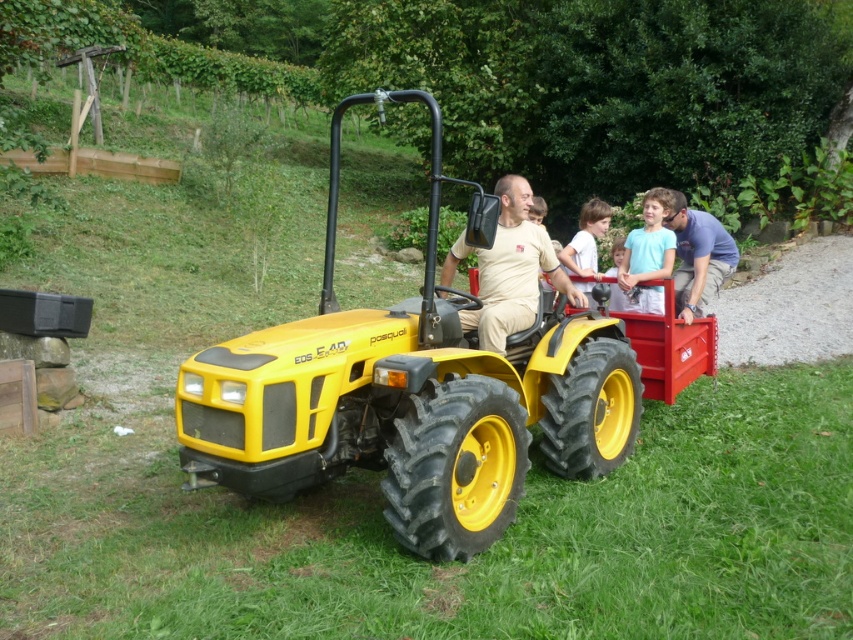
Question: Estimate the real-world distances between objects in this image. Which object is closer to the light brown hair at center?

Choices:
 (A) matte beige shirt at center
 (B) blue cotton shirt at right
 (C) light blue fabric shirt at upper right

Answer: (C)

Question: Which object is positioned closest to the light brown hair at center?

Choices:
 (A) matte beige shirt at center
 (B) blue cotton shirt at right
 (C) light blue fabric shirt at upper right

Answer: (C)

Question: From the image, what is the correct spatial relationship of matte beige shirt at center in relation to light blue fabric shirt at upper right?

Choices:
 (A) above
 (B) below

Answer: (B)

Question: Can you confirm if matte beige shirt at center is thinner than light brown hair at center?

Choices:
 (A) no
 (B) yes

Answer: (A)

Question: Which of the following is the closest to the observer?

Choices:
 (A) (653, 202)
 (B) (680, 314)
 (C) (485, 252)

Answer: (C)

Question: Does matte beige shirt at center have a greater width compared to blue cotton shirt at right?

Choices:
 (A) no
 (B) yes

Answer: (B)